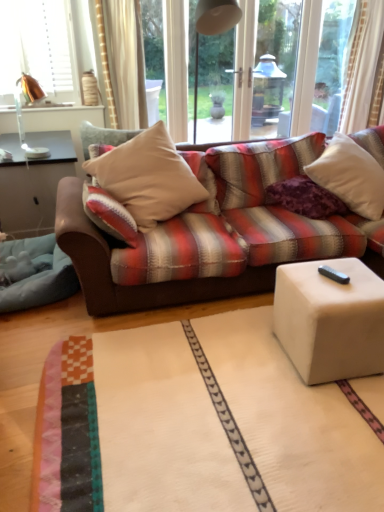
Question: Considering the positions of white matte cube at lower right and white soft cushion at upper right, arranged as the first pillow when viewed from the right, in the image, is white matte cube at lower right wider or thinner than white soft cushion at upper right, arranged as the first pillow when viewed from the right,?

Choices:
 (A) thin
 (B) wide

Answer: (A)

Question: From a real-world perspective, relative to white soft cushion at upper right, the 3th pillow positioned from the left, is white matte cube at lower right vertically above or below?

Choices:
 (A) below
 (B) above

Answer: (A)

Question: Estimate the real-world distances between objects in this image. Which object is closer to the white matte cube at lower right?

Choices:
 (A) white soft cushion at upper right, arranged as the first pillow when viewed from the right
 (B) black plastic remote control at lower right
 (C) purple velvet pillow at center, marked as the second pillow in a left-to-right arrangement
 (D) blue soft fabric at lower left
 (E) beige fabric pillow at center, the 1th pillow viewed from the left

Answer: (B)

Question: Which object is the closest to the black plastic remote control at lower right?

Choices:
 (A) white soft cushion at upper right, the 3th pillow positioned from the left
 (B) blue soft fabric at lower left
 (C) purple velvet pillow at center, marked as the second pillow in a left-to-right arrangement
 (D) white matte cube at lower right
 (E) copper metallic table lamp at upper left

Answer: (D)